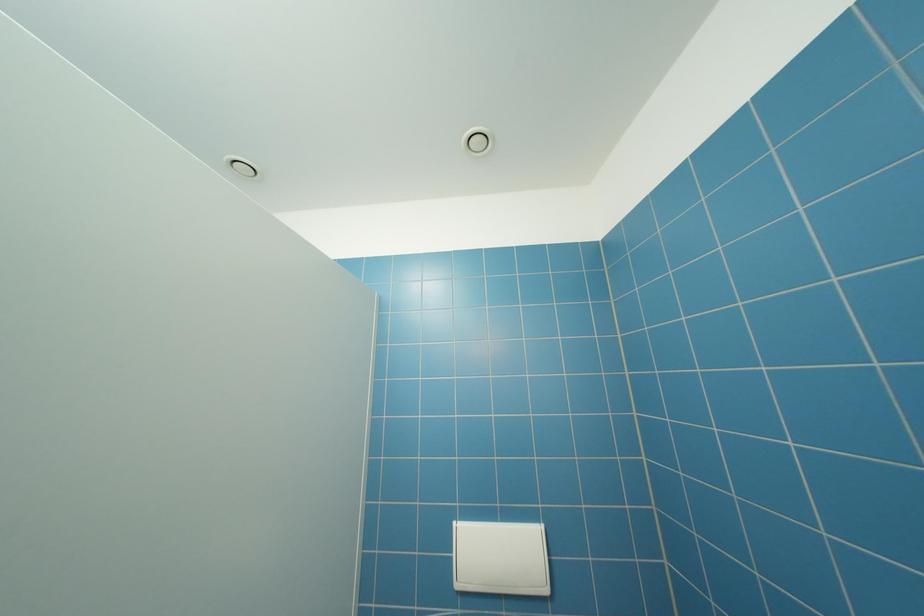
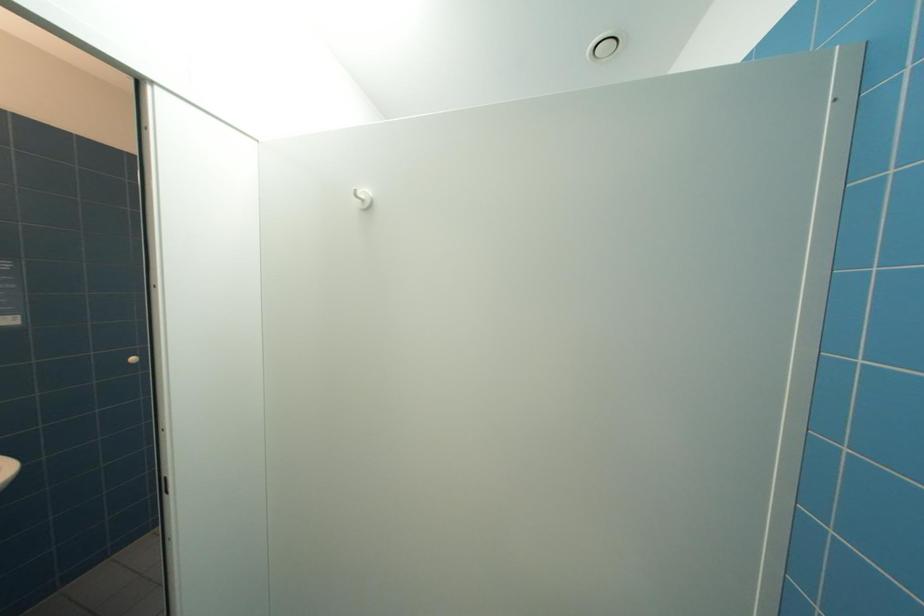
Question: The camera is either moving clockwise (left) or counter-clockwise (right) around the object. The first image is from the beginning of the video and the second image is from the end. Is the camera moving left or right when shooting the video?

Choices:
 (A) Left
 (B) Right

Answer: (B)